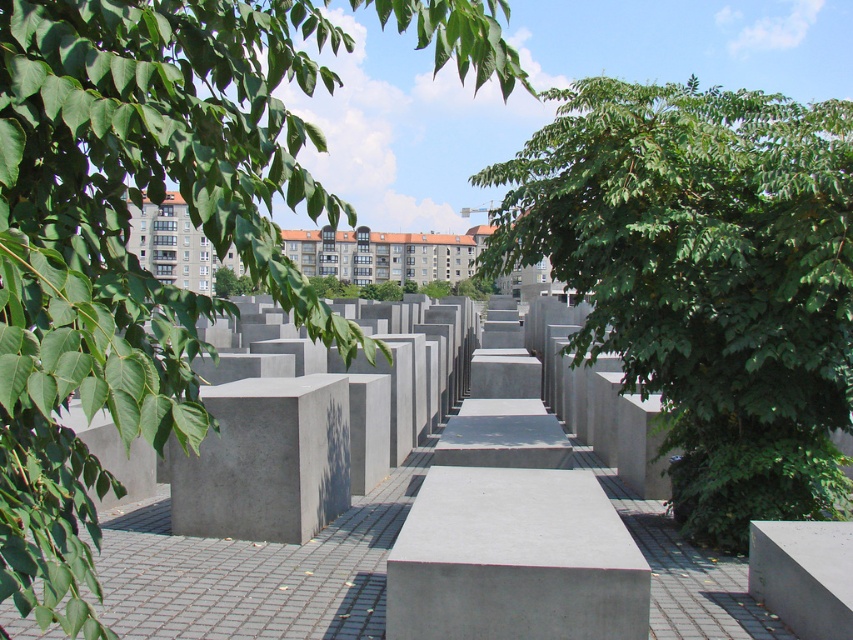
You are a visitor in this modern architectural space and want to sit on the gray concrete bench at center. Can you see the green leafy tree at upper left from there?

Yes, because the green leafy tree at upper left is above the gray concrete bench at center, so it should be visible from the bench.

You are standing at the point labeled as point [704,280] in the image. Looking around, what do you see directly in front of you?

You see a green leafy tree at center directly in front of you.